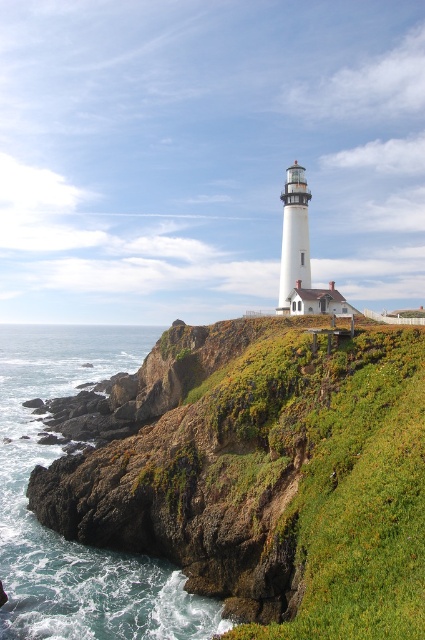
Can you confirm if green grassy hillside at center is positioned below blue-green water at lower left?

No.

Does green grassy hillside at center appear on the right side of blue-green water at lower left?

Correct, you'll find green grassy hillside at center to the right of blue-green water at lower left.

Does point (186, 397) come behind point (33, 624)?

Yes, point (186, 397) is behind point (33, 624).

Find the location of `green grassy hillside at center`. green grassy hillside at center is located at coordinates (266, 476).